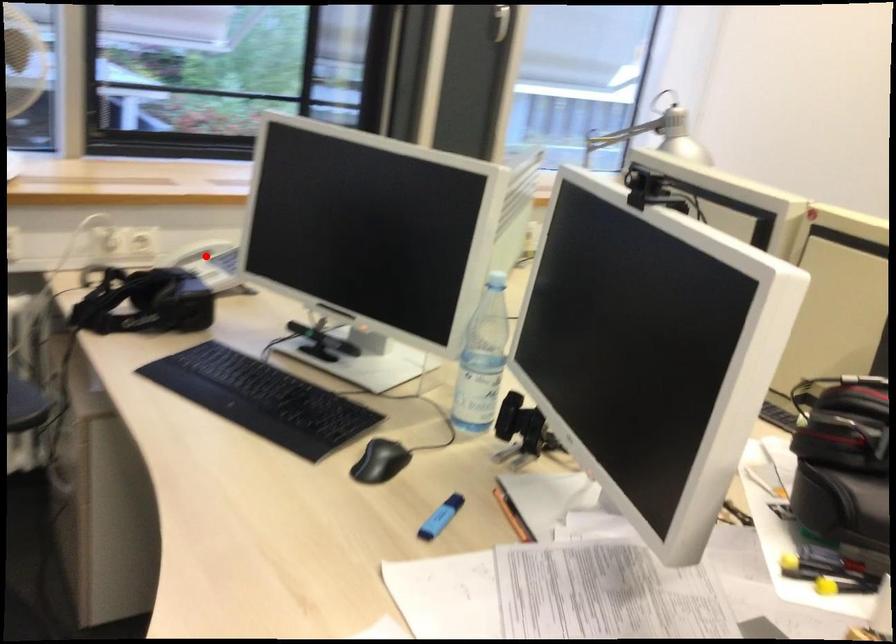
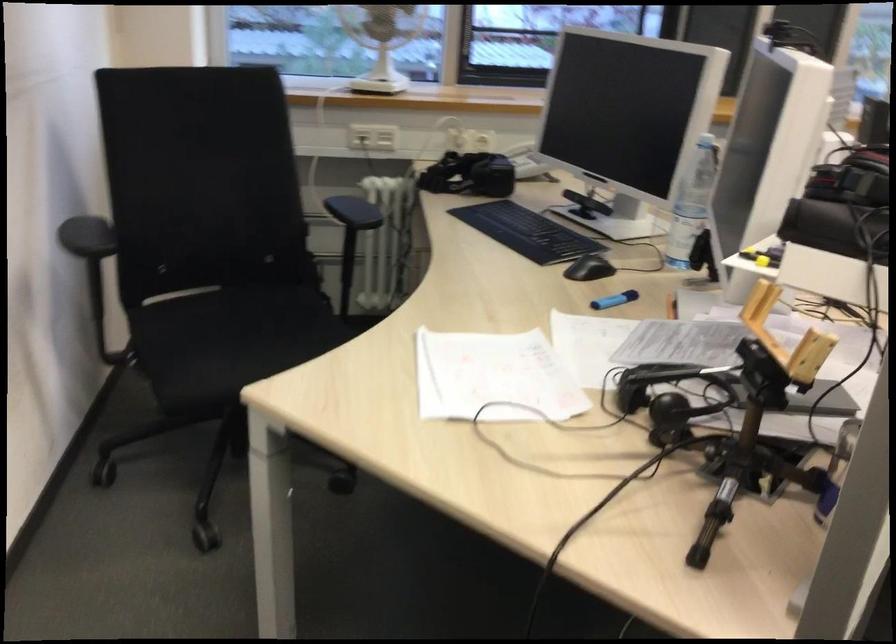
In the second image, find the point that corresponds to the highlighted location in the first image.

(519, 149)